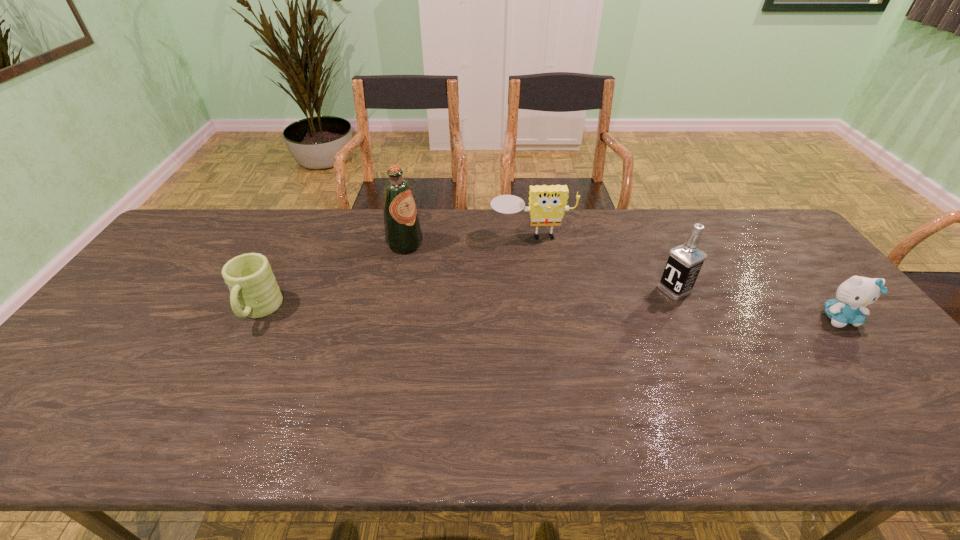
Locate an element on the screen. olive oil that is at the far edge is located at coordinates (403, 234).

Locate an element on the screen. The width and height of the screenshot is (960, 540). object located in the right edge section of the desktop is located at coordinates (854, 294).

This screenshot has height=540, width=960. I want to click on free space at the far edge of the desktop, so click(x=679, y=212).

This screenshot has width=960, height=540. I want to click on free space at the near edge of the desktop, so click(x=149, y=393).

Locate an element on the screen. free space at the left edge is located at coordinates (162, 270).

Where is `free space at the right edge of the desktop`? The height and width of the screenshot is (540, 960). free space at the right edge of the desktop is located at coordinates (807, 307).

You are a GUI agent. You are given a task and a screenshot of the screen. Output one action in this format:
    pyautogui.click(x=<x>, y=<y>)
    Task: Click on the vacant region at the far left corner of the desktop
    This screenshot has width=960, height=540.
    Given the screenshot: What is the action you would take?
    pyautogui.click(x=198, y=245)

This screenshot has height=540, width=960. I want to click on free space that is in between the tallest object and the mug, so click(x=331, y=278).

Where is `unoccupied position between the rightmost object and the tallest object`? Image resolution: width=960 pixels, height=540 pixels. unoccupied position between the rightmost object and the tallest object is located at coordinates (622, 281).

The height and width of the screenshot is (540, 960). In order to click on free point between the rightmost object and the mug in this screenshot , I will do `click(549, 314)`.